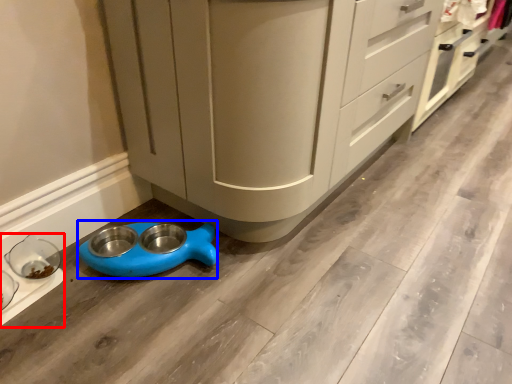
Question: Which object appears farthest to the camera in this image, appliance (highlighted by a red box) or appliance (highlighted by a blue box)?

Choices:
 (A) appliance
 (B) appliance

Answer: (B)